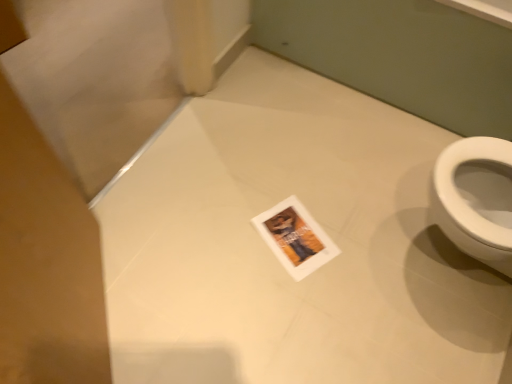
The height and width of the screenshot is (384, 512). I want to click on vacant space to the right of white paper postcard at center, so click(x=347, y=236).